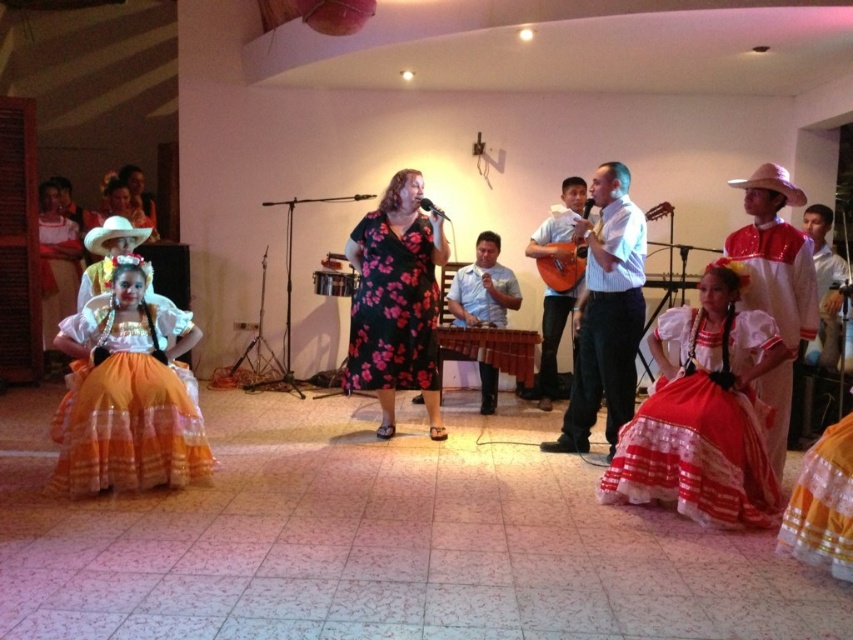
You are planning to seat guests at a table. The table has a width of 1.2 meters. You have two items to place on it. The red satin dress at right and the light blue shirt at center. Based on their sizes, which item should you place first to ensure both fit on the table?

The red satin dress at right has a smaller width than the light blue shirt at center. To ensure both items fit on the 1.2 meter table, you should place the wider light blue shirt at center first, then the narrower red satin dress at right.